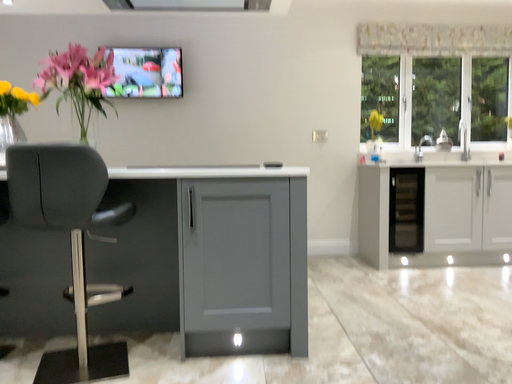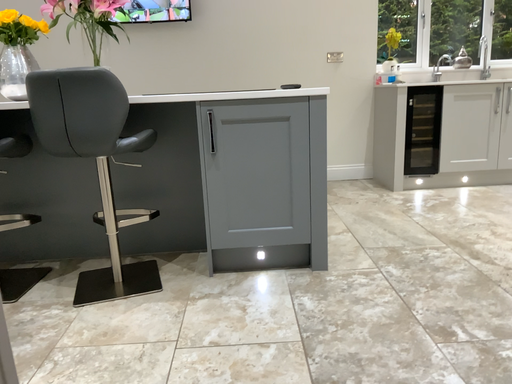
Question: Which way did the camera rotate in the video?

Choices:
 (A) rotated upward
 (B) rotated downward

Answer: (B)